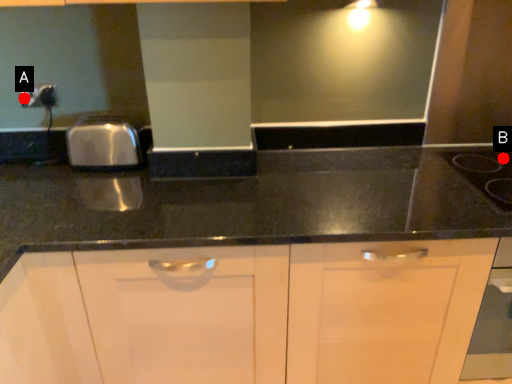
Question: Two points are circled on the image, labeled by A and B beside each circle. Which point is closer to the camera taking this photo?

Choices:
 (A) A is closer
 (B) B is closer

Answer: (A)